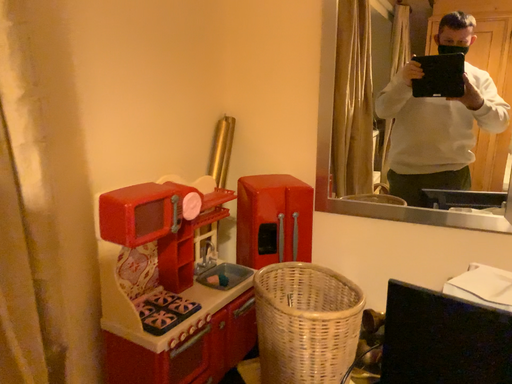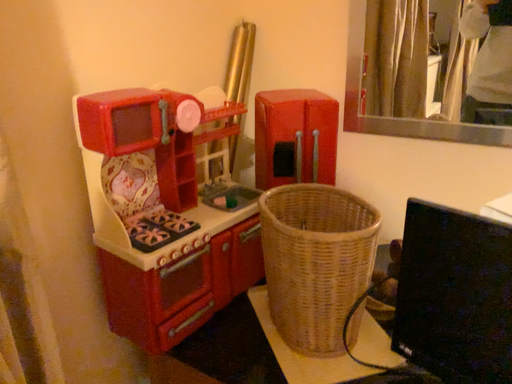
Question: How did the camera likely rotate when shooting the video?

Choices:
 (A) rotated downward
 (B) rotated upward

Answer: (A)